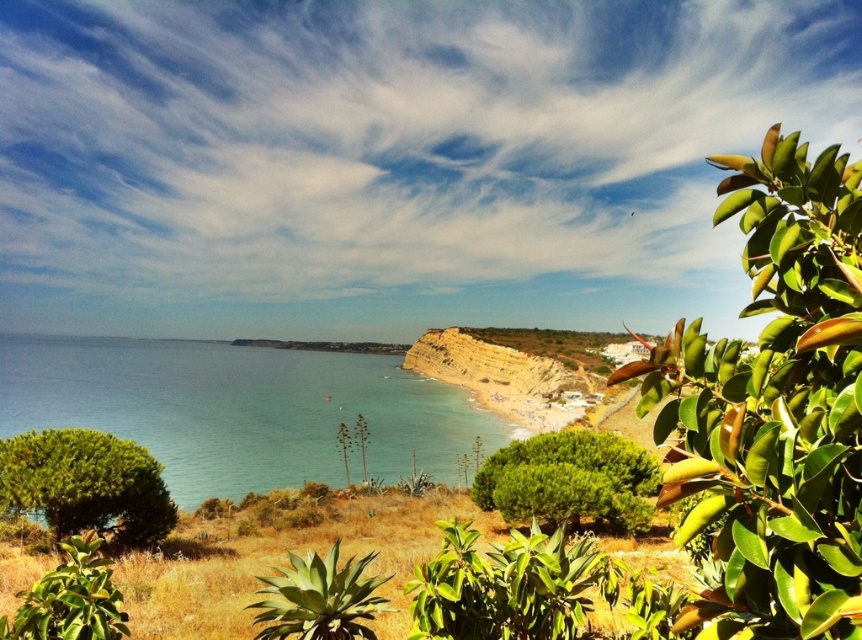
Question: Among these points, which one is nearest to the camera?

Choices:
 (A) (72, 554)
 (B) (109, 516)
 (C) (344, 579)

Answer: (C)

Question: Is the position of blue water at center less distant than that of green leafy bush at center?

Choices:
 (A) yes
 (B) no

Answer: (A)

Question: Does green leafy bush at lower left appear on the right side of green succulent at center?

Choices:
 (A) no
 (B) yes

Answer: (A)

Question: Does green glossy leaves at upper right appear on the left side of green glossy leaf at lower left?

Choices:
 (A) yes
 (B) no

Answer: (B)

Question: Which point is closer to the camera?

Choices:
 (A) green leafy bush at center
 (B) green glossy leaf at lower left
 (C) green leafy bush at lower left
 (D) green succulent at center

Answer: (B)

Question: Which object is positioned farthest from the blue water at center?

Choices:
 (A) green leafy bush at center
 (B) green leafy bush at lower left
 (C) green succulent at center

Answer: (A)